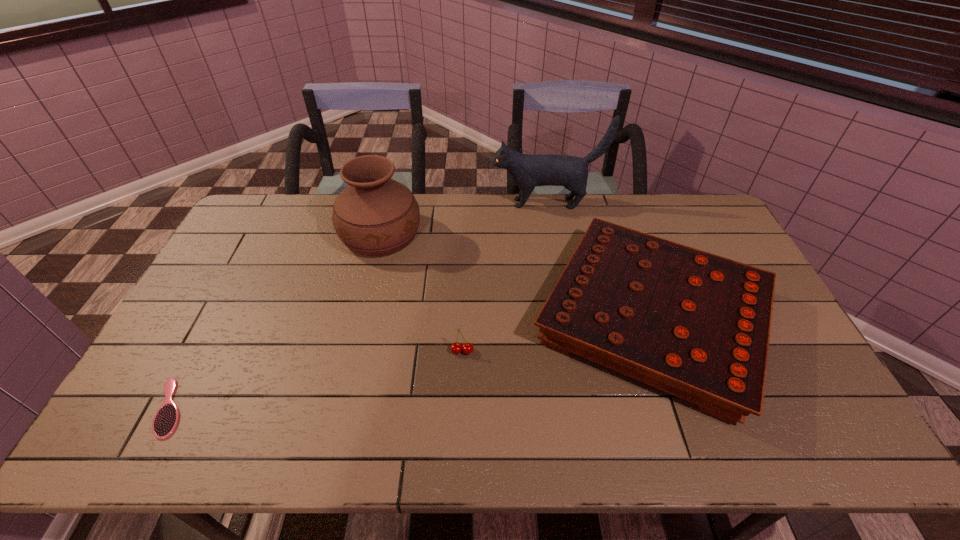
Find the location of a particular element. cat is located at coordinates (527, 171).

You are a GUI agent. You are given a task and a screenshot of the screen. Output one action in this format:
    pyautogui.click(x=<x>, y=<y>)
    Task: Click on the fourth shortest object
    The image size is (960, 540).
    Given the screenshot: What is the action you would take?
    pyautogui.click(x=374, y=215)

I want to click on the second object from left to right, so click(374, 215).

The width and height of the screenshot is (960, 540). I want to click on gameboard, so click(x=696, y=325).

At what (x,y) coordinates should I click in order to perform the action: click on cherry. Please return your answer as a coordinate pair (x, y). Looking at the image, I should click on (456, 347).

Identify the location of the third object from left to right. The width and height of the screenshot is (960, 540). (456, 347).

Where is `hairbrush`? This screenshot has width=960, height=540. hairbrush is located at coordinates (166, 419).

You are a GUI agent. You are given a task and a screenshot of the screen. Output one action in this format:
    pyautogui.click(x=<x>, y=<y>)
    Task: Click on the leftmost object
    The width and height of the screenshot is (960, 540).
    Given the screenshot: What is the action you would take?
    pyautogui.click(x=166, y=419)

Locate an element on the screen. free space located at the face of the tallest object is located at coordinates (449, 203).

Find the location of a particular element. The width and height of the screenshot is (960, 540). free location located at the face of the tallest object is located at coordinates (475, 203).